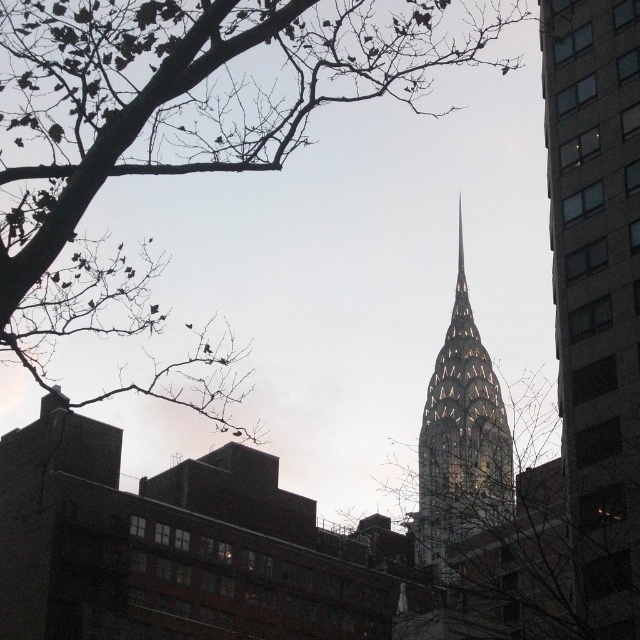
Based on the scene description, where exactly is the brown leafy branches at upper left located in the image?

The brown leafy branches at upper left are located at the 2D coordinates point (177, 122) in the image.

You are a window washer working on the Chrysler Building. You notice brown leafy branches at upper left that are 137.62 feet away from your current position. Your ladder can extend up to 120 feet. Can you safely reach the branches with your ladder?

The brown leafy branches at upper left are 137.62 feet away from your position, which exceeds the ladder extension limit of 120 feet. Therefore, you cannot safely reach them with your current ladder.

You are standing in a park and want to take a photo of the gray concrete building at center. However, the brown leafy branches at upper left are blocking your view. Can you move to the right to avoid the branches?

The brown leafy branches at upper left are closer to the viewer than the gray concrete building at center, so moving to the right might help you avoid the branches and get a clear view of the gray concrete building at center.